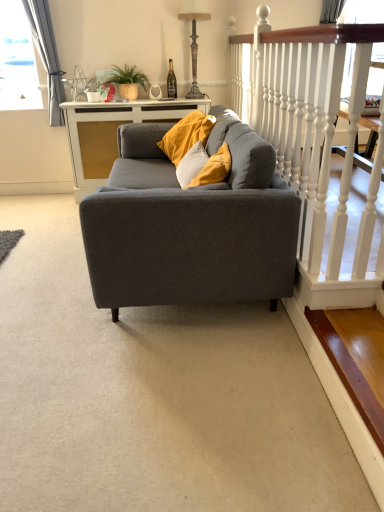
Find the location of `vacant region below antique bronze lamp at upper center (from a real-world perspective)`. vacant region below antique bronze lamp at upper center (from a real-world perspective) is located at coordinates (195, 99).